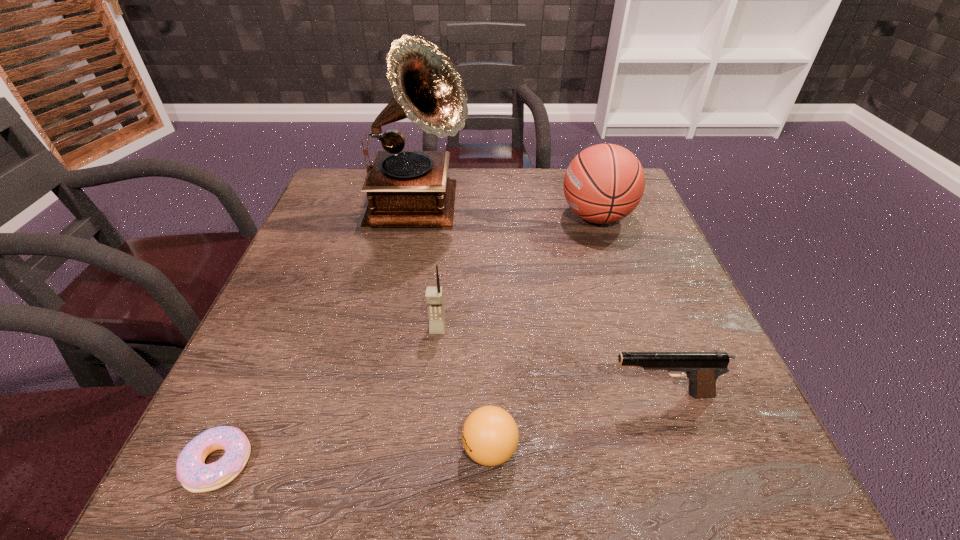
Identify the location of free region located 0.270m on the back of the leftmost object. The height and width of the screenshot is (540, 960). (288, 309).

This screenshot has height=540, width=960. Find the location of `record player at the far edge`. record player at the far edge is located at coordinates (404, 188).

The width and height of the screenshot is (960, 540). I want to click on basketball positioned at the far edge, so click(x=604, y=183).

Where is `ping-pong ball located in the near edge section of the desktop`? ping-pong ball located in the near edge section of the desktop is located at coordinates (490, 435).

This screenshot has height=540, width=960. Identify the location of doughnut that is at the near edge. (195, 476).

This screenshot has width=960, height=540. I want to click on record player present at the left edge, so click(404, 188).

In order to click on doughnut situated at the left edge in this screenshot , I will do `click(195, 476)`.

In order to click on basketball positioned at the right edge in this screenshot , I will do `click(604, 183)`.

Identify the location of pistol that is at the right edge. (702, 368).

Locate an element on the screen. This screenshot has height=540, width=960. object present at the far left corner is located at coordinates (404, 188).